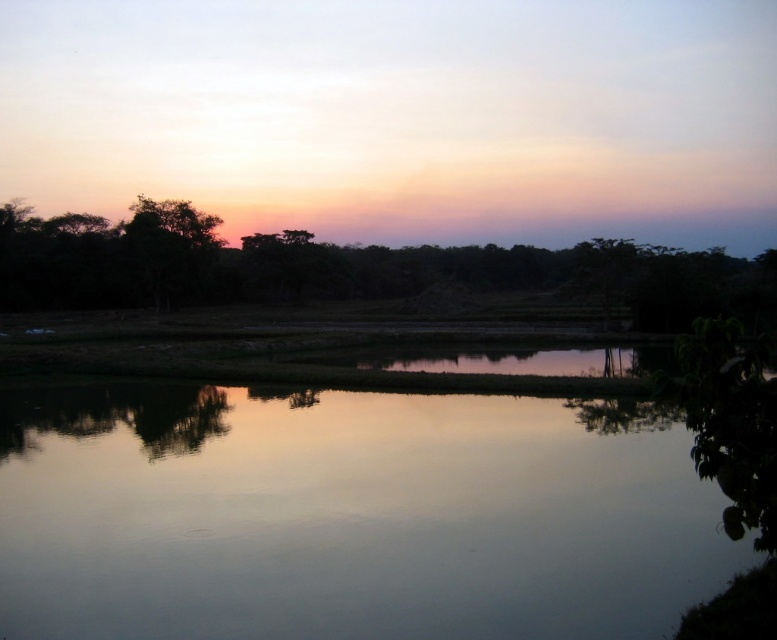
You are an artist trying to paint the sunset scene. You want to place the silvery reflective water at center in your painting. Where should you position it on your canvas using coordinates?

The silvery reflective water at center should be positioned at coordinates point [347,515] on the canvas.

You are an artist trying to paint the sunset scene. You notice the silvery reflective water at center and the silhouette leafy tree at center. Which object appears taller in the painting?

The silhouette leafy tree at center appears taller than the silvery reflective water at center in the painting.

You are an artist trying to paint the sunset scene. You notice the silvery reflective water at center and the silhouette leafy tree at center. Which one appears narrower in the image?

The silvery reflective water at center has a lesser width compared to the silhouette leafy tree at center, so it appears narrower in the image.